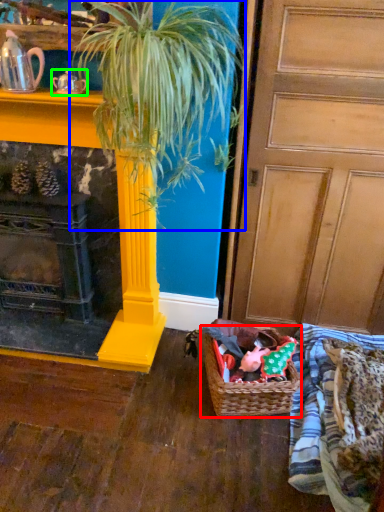
Question: Based on their relative distances, which object is farther from basket (highlighted by a red box)? Choose from houseplant (highlighted by a blue box) and tea pot (highlighted by a green box).

Choices:
 (A) houseplant
 (B) tea pot

Answer: (B)